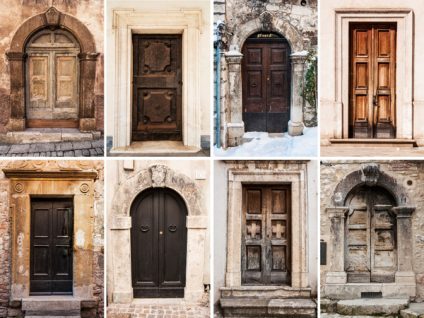
Locate an element on the screen. wooden doors is located at coordinates (50, 93), (152, 96), (264, 78), (363, 75), (49, 238), (165, 237), (275, 234), (361, 239).